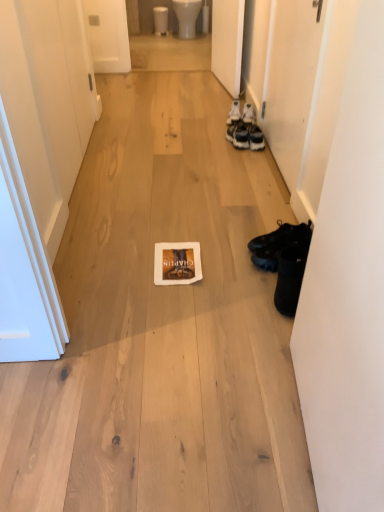
Identify the location of vacant space in front of white matte door at right, marked as the first door in a right-to-left arrangement. (244, 197).